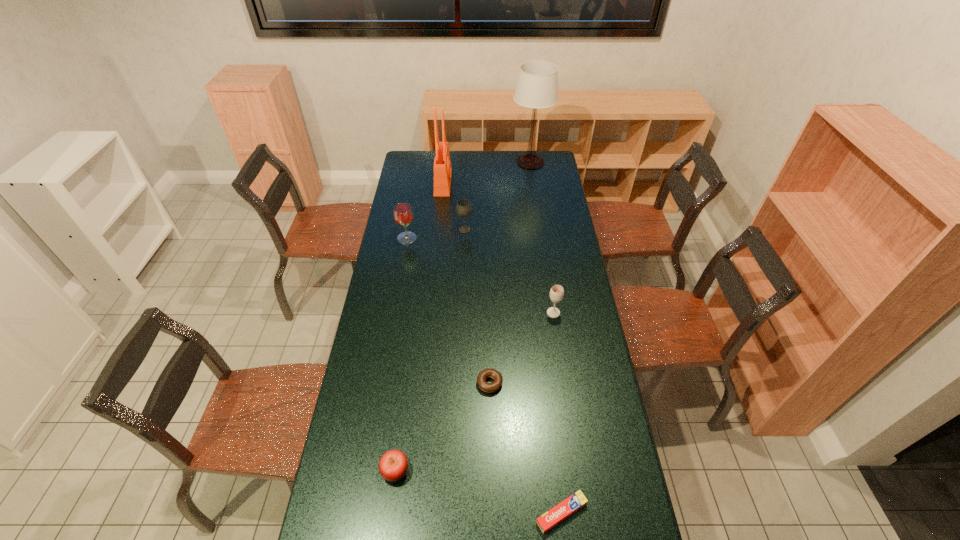
Locate an element on the screen. table lamp is located at coordinates (537, 84).

Identify the location of tote bag. (442, 169).

You are a GUI agent. You are given a task and a screenshot of the screen. Output one action in this format:
    pyautogui.click(x=<x>, y=<y>)
    Task: Click on the leftmost wineglass
    
    Given the screenshot: What is the action you would take?
    pyautogui.click(x=403, y=215)

Image resolution: width=960 pixels, height=540 pixels. I want to click on the fourth object from left to right, so click(x=463, y=208).

Image resolution: width=960 pixels, height=540 pixels. I want to click on the fourth nearest object, so click(x=557, y=292).

You are a GUI agent. You are given a task and a screenshot of the screen. Output one action in this format:
    pyautogui.click(x=<x>, y=<y>)
    Task: Click on the rightmost wineglass
    The height and width of the screenshot is (540, 960).
    Given the screenshot: What is the action you would take?
    pyautogui.click(x=557, y=292)

Image resolution: width=960 pixels, height=540 pixels. In order to click on apple in this screenshot , I will do `click(393, 465)`.

Find the location of a particular element. the seventh farthest object is located at coordinates (393, 465).

Locate an element on the screen. The image size is (960, 540). the fifth object from left to right is located at coordinates (487, 387).

Where is `the third nearest object`? the third nearest object is located at coordinates (487, 387).